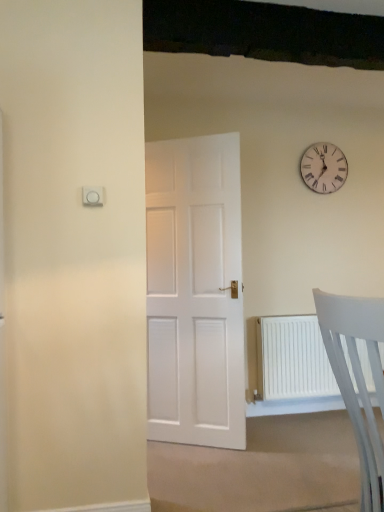
Describe the element at coordinates (324, 168) in the screenshot. I see `white wooden clock at upper right` at that location.

Measure the distance between point (312, 157) and camera.

Point (312, 157) is 3.33 meters from camera.

The width and height of the screenshot is (384, 512). I want to click on white wooden clock at upper right, so click(324, 168).

This screenshot has height=512, width=384. I want to click on white plastic chair at lower right, so click(357, 377).

Image resolution: width=384 pixels, height=512 pixels. What do you see at coordinates (357, 377) in the screenshot?
I see `white plastic chair at lower right` at bounding box center [357, 377].

At what (x,y) coordinates should I click in order to perform the action: click on white wooden clock at upper right. Please return your answer as a coordinate pair (x, y). Looking at the image, I should click on (324, 168).

In the scene shown: Which object is positioned more to the right, white plastic chair at lower right or white wooden clock at upper right?

white wooden clock at upper right.

Does white plastic chair at lower right come in front of white wooden clock at upper right?

Yes, white plastic chair at lower right is closer to the camera.

Which is closer, (370,416) or (329,175)?

Clearly, point (370,416) is closer to the camera than point (329,175).

From the image's perspective, is white plastic chair at lower right located above or below white wooden clock at upper right?

Based on their image positions, white plastic chair at lower right is located beneath white wooden clock at upper right.

Based on the photo, from a real-world perspective, is white plastic chair at lower right beneath white wooden clock at upper right?

Yes.

Which of these two, white plastic chair at lower right or white wooden clock at upper right, is thinner?

white wooden clock at upper right is thinner.

Does white plastic chair at lower right have a greater height compared to white wooden clock at upper right?

Indeed, white plastic chair at lower right has a greater height compared to white wooden clock at upper right.

Considering the sizes of objects white plastic chair at lower right and white wooden clock at upper right in the image provided, who is smaller, white plastic chair at lower right or white wooden clock at upper right?

With smaller size is white wooden clock at upper right.

Is white plastic chair at lower right inside or outside of white wooden clock at upper right?

white plastic chair at lower right cannot be found inside white wooden clock at upper right.

Consider the image. Is there a large distance between white plastic chair at lower right and white wooden clock at upper right?

Yes, white plastic chair at lower right and white wooden clock at upper right are located far from each other.

Could you tell me if white plastic chair at lower right is turned towards white wooden clock at upper right?

No, white plastic chair at lower right is not oriented towards white wooden clock at upper right.

What's the angular difference between white plastic chair at lower right and white wooden clock at upper right's facing directions?

There is a 90.7-degree angle between the facing directions of white plastic chair at lower right and white wooden clock at upper right.

Locate an element on the screen. This screenshot has height=512, width=384. chair on the left of white wooden clock at upper right is located at coordinates (357, 377).

Is white wooden clock at upper right to the right of white plastic chair at lower right from the viewer's perspective?

Correct, you'll find white wooden clock at upper right to the right of white plastic chair at lower right.

Does white wooden clock at upper right come in front of white plastic chair at lower right?

No, it is not.

Considering the positions of point (323, 178) and point (376, 362), is point (323, 178) closer or farther from the camera than point (376, 362)?

Point (323, 178) appears to be farther away from the viewer than point (376, 362).

From the image's perspective, who appears lower, white wooden clock at upper right or white plastic chair at lower right?

From the image's view, white plastic chair at lower right is below.

From a real-world perspective, is white wooden clock at upper right positioned above or below white plastic chair at lower right?

white wooden clock at upper right is situated higher than white plastic chair at lower right in the real world.

Does white wooden clock at upper right have a greater width compared to white plastic chair at lower right?

No.

Can you confirm if white wooden clock at upper right is shorter than white plastic chair at lower right?

Yes, white wooden clock at upper right is shorter than white plastic chair at lower right.

Who is smaller, white wooden clock at upper right or white plastic chair at lower right?

white wooden clock at upper right is smaller.

Is white wooden clock at upper right spatially inside white plastic chair at lower right, or outside of it?

white wooden clock at upper right exists outside the volume of white plastic chair at lower right.

Is the surface of white wooden clock at upper right in direct contact with white plastic chair at lower right?

No, white wooden clock at upper right is not with white plastic chair at lower right.

Is white plastic chair at lower right at the back of white wooden clock at upper right?

white wooden clock at upper right is not turned away from white plastic chair at lower right.

How distant is white wooden clock at upper right from white plastic chair at lower right?

white wooden clock at upper right is 7.52 feet away from white plastic chair at lower right.

Locate an element on the screen. wall clock on the right side of white plastic chair at lower right is located at coordinates (324, 168).

I want to click on chair that is under the white wooden clock at upper right (from a real-world perspective), so click(357, 377).

Find the location of a particular element. Image resolution: width=384 pixels, height=512 pixels. wall clock behind the white plastic chair at lower right is located at coordinates (324, 168).